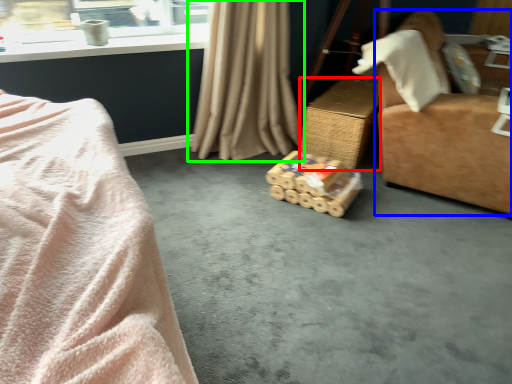
Question: Considering the real-world distances, which object is farthest from table (highlighted by a red box)? furniture (highlighted by a blue box) or curtain (highlighted by a green box)?

Choices:
 (A) furniture
 (B) curtain

Answer: (A)